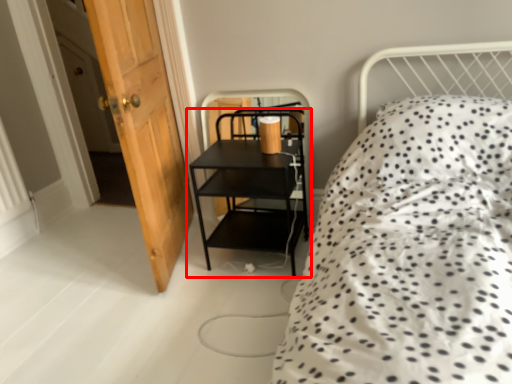
Question: From the image's perspective, where is shelf (annotated by the red box) located relative to door?

Choices:
 (A) below
 (B) above

Answer: (A)